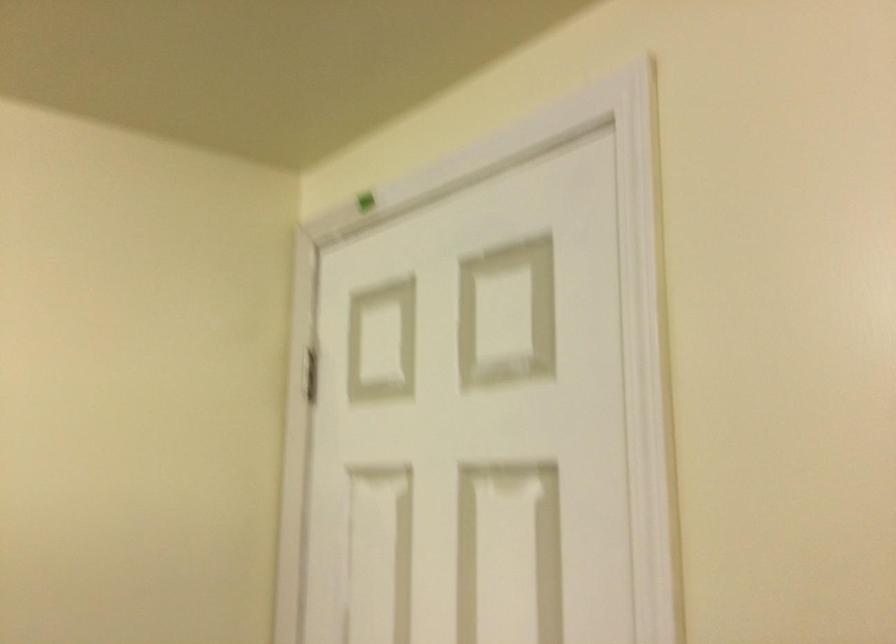
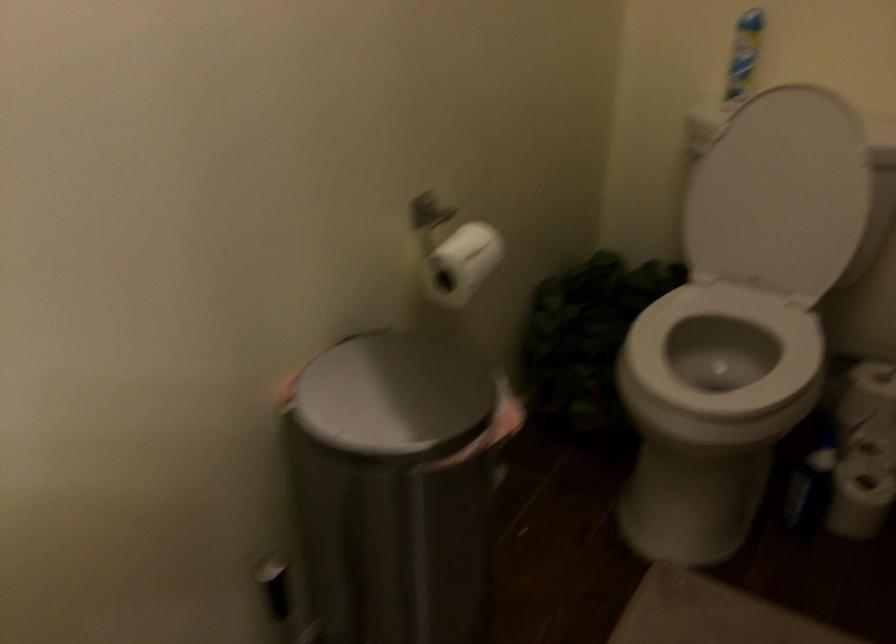
The first image is from the beginning of the video and the second image is from the end. How did the camera likely rotate when shooting the video?

The rotation direction of the camera is right-down.